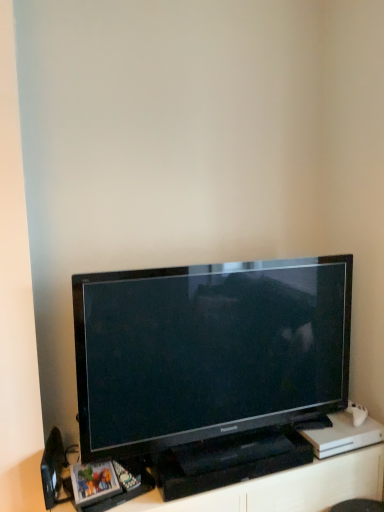
Measure the distance between point (55, 473) and camera.

4.47 feet.

You are a GUI agent. You are given a task and a screenshot of the screen. Output one action in this format:
    pyautogui.click(x=<x>, y=<y>)
    Task: Click on the black plastic entertainment center at lower center
    
    Given the screenshot: What is the action you would take?
    pyautogui.click(x=285, y=488)

Can you confirm if black plastic speaker at lower left is shorter than black plastic entertainment center at lower center?

Correct, black plastic speaker at lower left is not as tall as black plastic entertainment center at lower center.

Locate an element on the screen. The width and height of the screenshot is (384, 512). entertainment center below the black plastic speaker at lower left (from the image's perspective) is located at coordinates (285, 488).

Which point is more distant from viewer, (57, 460) or (150, 498)?

Point (57, 460)

Is black plastic entertainment center at lower center situated inside black glossy television at center or outside?

black plastic entertainment center at lower center is outside black glossy television at center.

Based on their positions, is black plastic entertainment center at lower center located to the left or right of black glossy television at center?

From the image, it's evident that black plastic entertainment center at lower center is to the left of black glossy television at center.

Considering the relative sizes of black plastic entertainment center at lower center and black glossy television at center in the image provided, is black plastic entertainment center at lower center wider than black glossy television at center?

Indeed, black plastic entertainment center at lower center has a greater width compared to black glossy television at center.

In terms of height, does black plastic entertainment center at lower center look taller or shorter compared to black glossy television at center?

Clearly, black plastic entertainment center at lower center is shorter compared to black glossy television at center.

Measure the distance from black glossy television at center to black plastic entertainment center at lower center.

14.65 inches.

Is point (248, 298) less distant than point (293, 499)?

No, (248, 298) is further to viewer.

Does black glossy television at center have a smaller size compared to black plastic entertainment center at lower center?

Correct, black glossy television at center occupies less space than black plastic entertainment center at lower center.

From the picture: From a real-world perspective, is black glossy television at center positioned under black plastic entertainment center at lower center based on gravity?

No, from a real-world perspective, black glossy television at center is not beneath black plastic entertainment center at lower center.

Is black plastic speaker at lower left touching black glossy television at center?

No, black plastic speaker at lower left is not making contact with black glossy television at center.

Which object is wider, black plastic speaker at lower left or black glossy television at center?

Wider between the two is black glossy television at center.

Is black plastic speaker at lower left taller or shorter than black glossy television at center?

Considering their sizes, black plastic speaker at lower left has less height than black glossy television at center.

Does black plastic speaker at lower left appear on the right side of black glossy television at center?

No, black plastic speaker at lower left is not to the right of black glossy television at center.

Which object is thinner, black glossy television at center or black plastic speaker at lower left?

Thinner between the two is black plastic speaker at lower left.

From a real-world perspective, is black glossy television at center located higher than black plastic speaker at lower left?

Indeed, from a real-world perspective, black glossy television at center stands above black plastic speaker at lower left.

Between black glossy television at center and black plastic speaker at lower left, which one is positioned in front?

black glossy television at center is more forward.

Between point (317, 509) and point (45, 476), which one is positioned behind?

Positioned behind is point (317, 509).

Find the location of a particular element. This screenshot has height=512, width=384. speaker to the left of black plastic entertainment center at lower center is located at coordinates (52, 468).

Which of these two, black plastic entertainment center at lower center or black plastic speaker at lower left, stands shorter?

black plastic speaker at lower left.

Identify the location of entertainment center that is under the black plastic speaker at lower left (from a real-world perspective). This screenshot has height=512, width=384. (285, 488).

What are the coordinates of `entertainment center on the left of black glossy television at center` in the screenshot? It's located at (285, 488).

Based on their spatial positions, is black plastic speaker at lower left or black plastic entertainment center at lower center further from black glossy television at center?

black plastic speaker at lower left is positioned further to the anchor black glossy television at center.

From the image, which object appears to be nearer to black plastic speaker at lower left, black plastic entertainment center at lower center or black glossy television at center?

Among the two, black plastic entertainment center at lower center is located nearer to black plastic speaker at lower left.

Looking at the image, which one is located closer to black plastic entertainment center at lower center, black glossy television at center or black plastic speaker at lower left?

black glossy television at center is positioned closer to the anchor black plastic entertainment center at lower center.

From the image, which object appears to be nearer to black plastic entertainment center at lower center, black plastic speaker at lower left or black glossy television at center?

The object closer to black plastic entertainment center at lower center is black glossy television at center.

From the image, which object appears to be nearer to black plastic speaker at lower left, black glossy television at center or black plastic entertainment center at lower center?

black plastic entertainment center at lower center lies closer to black plastic speaker at lower left than the other object.

From the image, which object appears to be farther from black glossy television at center, black plastic entertainment center at lower center or black plastic speaker at lower left?

black plastic speaker at lower left.

In order to click on speaker between black glossy television at center and black plastic entertainment center at lower center in the up-down direction in this screenshot , I will do `click(52, 468)`.